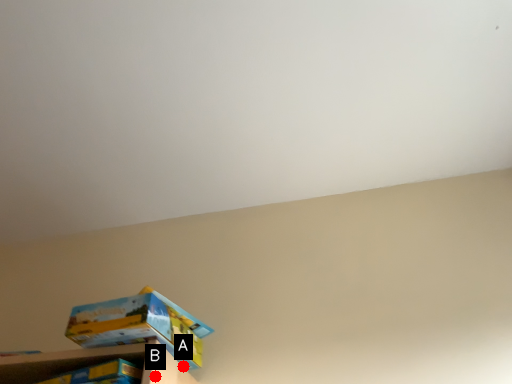
Question: Two points are circled on the image, labeled by A and B beside each circle. Which point is closer to the camera?

Choices:
 (A) A is closer
 (B) B is closer

Answer: (B)